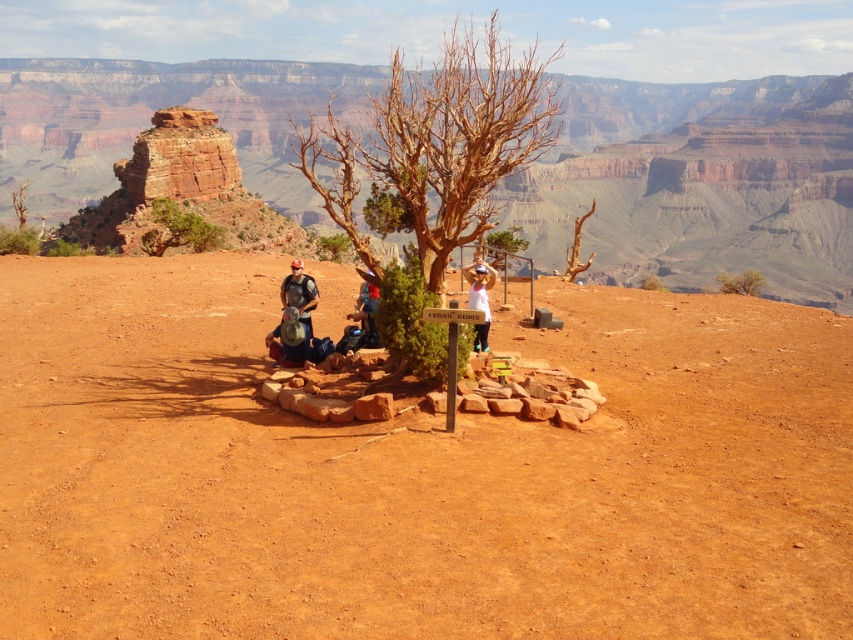
From the picture: Does matte gray backpack at center have a larger size compared to white fabric at center?

No.

Looking at this image, measure the distance between matte gray backpack at center and camera.

The distance of matte gray backpack at center from camera is 36.11 meters.

This screenshot has height=640, width=853. What do you see at coordinates (294, 340) in the screenshot?
I see `matte gray backpack at center` at bounding box center [294, 340].

At what (x,y) coordinates should I click in order to perform the action: click on matte gray backpack at center. Please return your answer as a coordinate pair (x, y). The width and height of the screenshot is (853, 640). Looking at the image, I should click on (294, 340).

Does rustic rock formation at center come behind blue fabric backpack at center?

Yes, it is behind blue fabric backpack at center.

Is point (695, 216) farther from viewer compared to point (349, 316)?

Yes, it is.

Locate an element on the screen. rustic rock formation at center is located at coordinates (700, 182).

From the picture: Does white fabric at center have a lesser height compared to blue fabric backpack at center?

No.

Does white fabric at center come behind blue fabric backpack at center?

No, white fabric at center is closer to the viewer.

What do you see at coordinates (480, 298) in the screenshot? The image size is (853, 640). I see `white fabric at center` at bounding box center [480, 298].

Locate an element on the screen. This screenshot has height=640, width=853. white fabric at center is located at coordinates (480, 298).